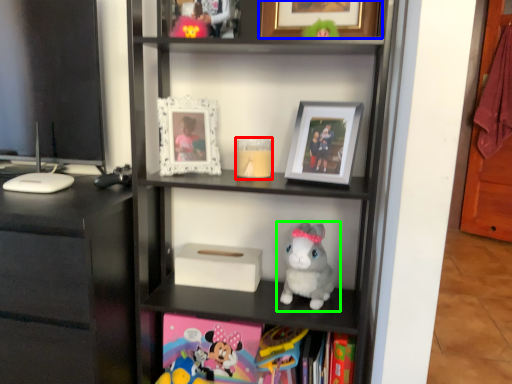
Question: Estimate the real-world distances between objects in this image. Which object is farther from candle holder (highlighted by a red box), picture frame (highlighted by a blue box) or toy (highlighted by a green box)?

Choices:
 (A) picture frame
 (B) toy

Answer: (A)